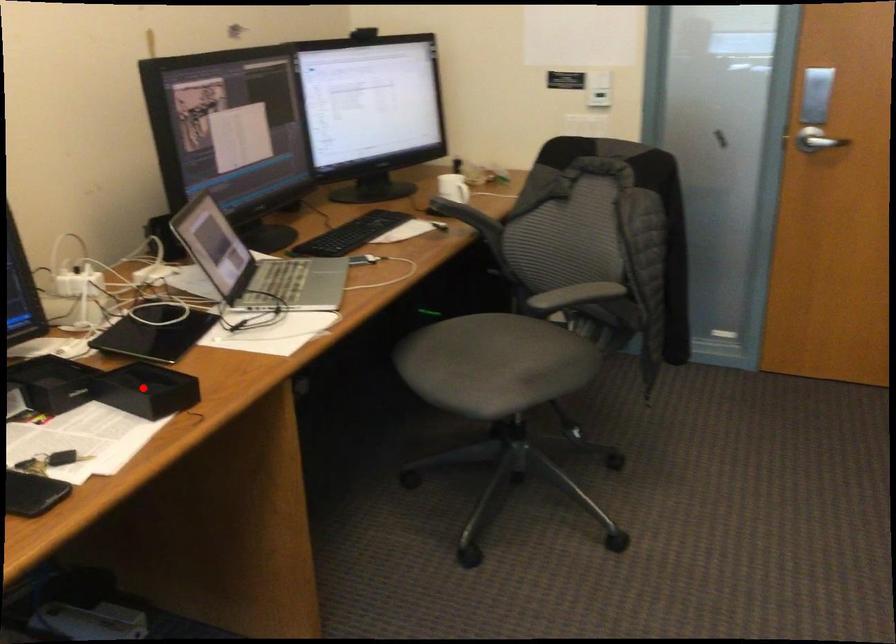
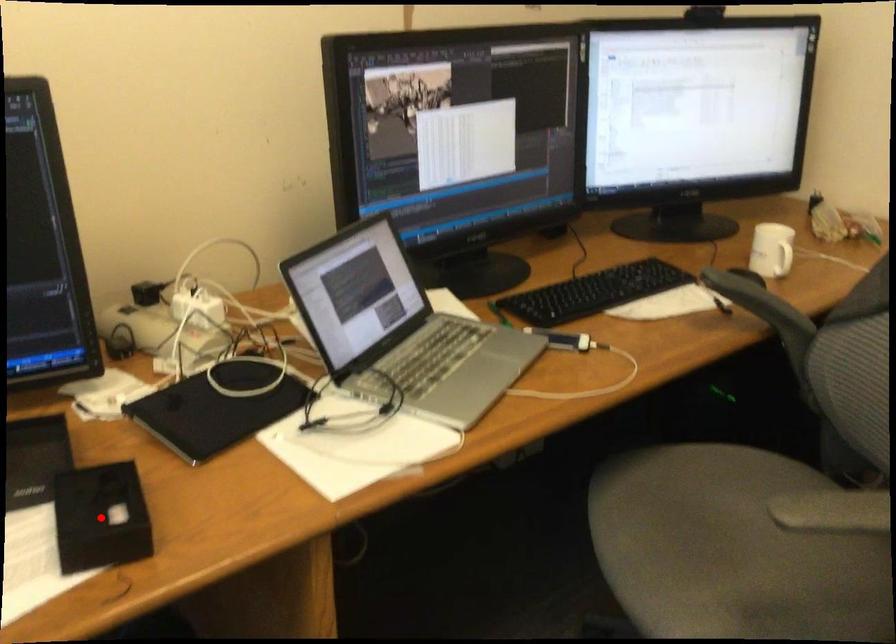
I am providing you with two images of the same scene from different viewpoints. A red point is marked on the first image and another point is marked on the second image. Is the red point in image1 aligned with the point shown in image2?

Yes